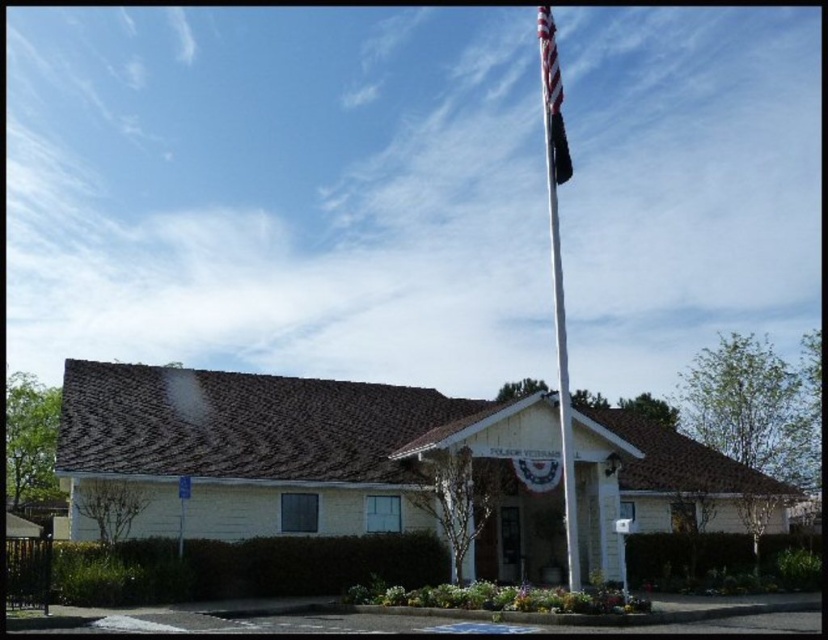
Does white metallic flag pole at upper center appear under american flag at upper right?

Yes, white metallic flag pole at upper center is below american flag at upper right.

Can you confirm if white metallic flag pole at upper center is positioned to the right of american flag at upper right?

Yes, white metallic flag pole at upper center is to the right of american flag at upper right.

Which is behind, point (555, 193) or point (549, 28)?

The point (555, 193) is more distant.

Locate an element on the screen. white metallic flag pole at upper center is located at coordinates (557, 266).